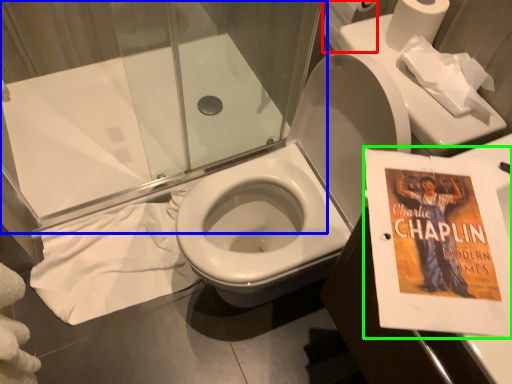
Question: Based on their relative distances, which object is nearer to toilet paper (highlighted by a red box)? Choose from shower door (highlighted by a blue box) and paperback book (highlighted by a green box).

Choices:
 (A) shower door
 (B) paperback book

Answer: (B)